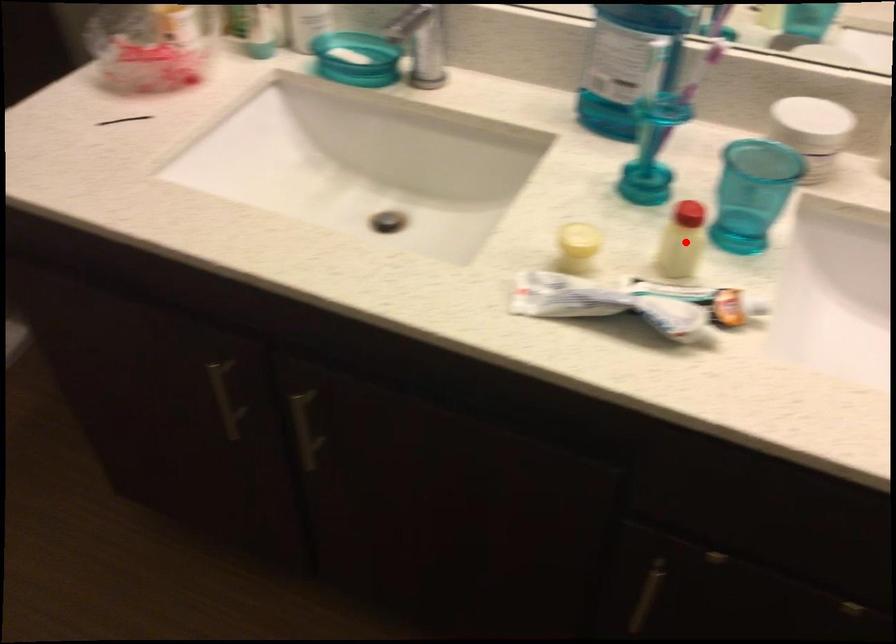
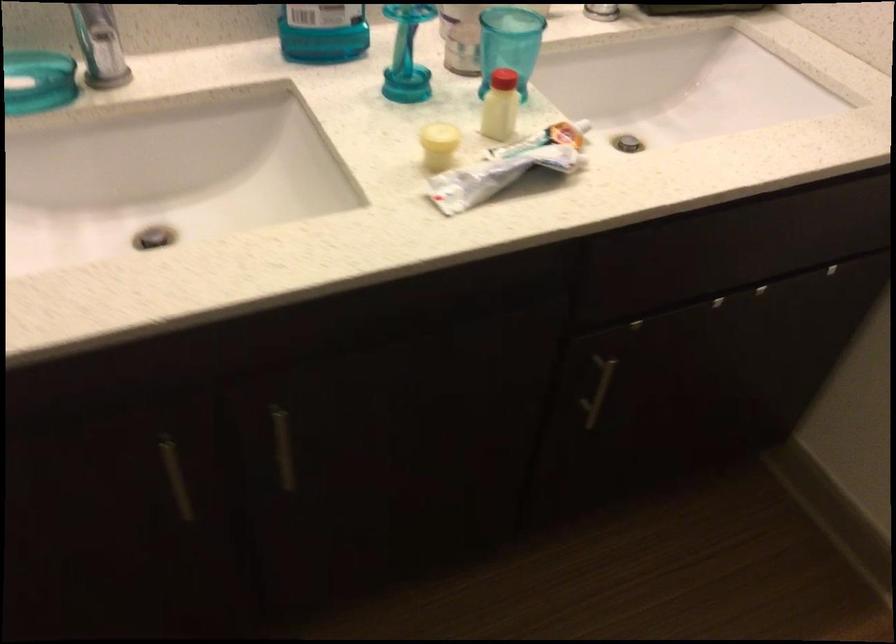
Find the pixel in the second image that matches the highlighted location in the first image.

(501, 106)